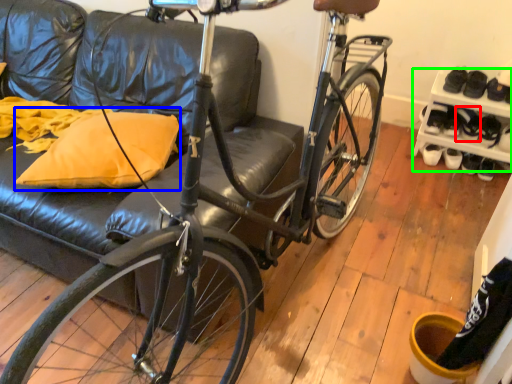
Question: Which object is positioned farthest from shoe (highlighted by a red box)? Select from throw pillow (highlighted by a blue box) and shelf (highlighted by a green box).

Choices:
 (A) throw pillow
 (B) shelf

Answer: (A)